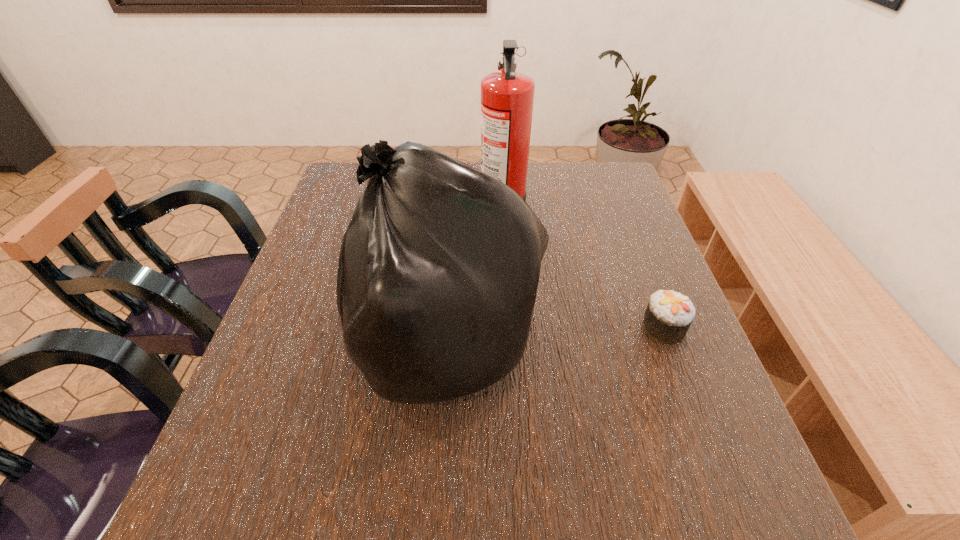
The width and height of the screenshot is (960, 540). Find the location of `free spot between the shortest object and the plastic bag`. free spot between the shortest object and the plastic bag is located at coordinates (553, 334).

This screenshot has width=960, height=540. Identify the location of free space that is in between the plastic bag and the shortest object. (553, 334).

This screenshot has width=960, height=540. I want to click on free space between the rightmost object and the farthest object, so click(x=583, y=266).

Where is `object that can be found as the closest to the plastic bag`? This screenshot has height=540, width=960. object that can be found as the closest to the plastic bag is located at coordinates (507, 97).

The width and height of the screenshot is (960, 540). I want to click on object identified as the second closest to the plastic bag, so click(x=669, y=314).

Where is `free space that satisfies the following two spatial constraints: 1. on the front-facing side of the rightmost object; 2. on the right side of the fire extinguisher`? This screenshot has height=540, width=960. free space that satisfies the following two spatial constraints: 1. on the front-facing side of the rightmost object; 2. on the right side of the fire extinguisher is located at coordinates (510, 328).

In order to click on free space that satisfies the following two spatial constraints: 1. on the front-facing side of the fire extinguisher; 2. on the front side of the plastic bag in this screenshot , I will do `click(511, 340)`.

Locate an element on the screen. Image resolution: width=960 pixels, height=540 pixels. vacant space that satisfies the following two spatial constraints: 1. on the front-facing side of the cupcake; 2. on the right side of the fire extinguisher is located at coordinates (510, 328).

At what (x,y) coordinates should I click in order to perform the action: click on vacant position in the image that satisfies the following two spatial constraints: 1. on the back side of the plastic bag; 2. on the right side of the cupcake. Please return your answer as a coordinate pair (x, y). The width and height of the screenshot is (960, 540). Looking at the image, I should click on (444, 328).

This screenshot has height=540, width=960. I want to click on vacant space that satisfies the following two spatial constraints: 1. on the front-facing side of the cupcake; 2. on the right side of the fire extinguisher, so click(510, 328).